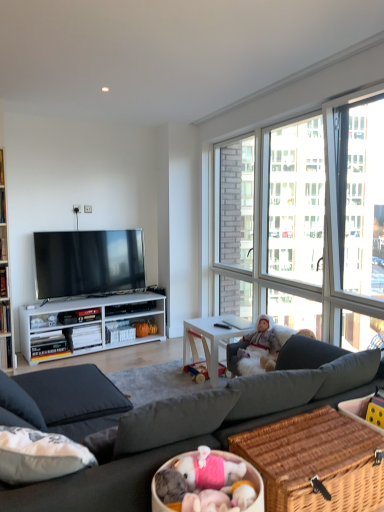
Question: Could woven brown picnic basket at lower right be considered to be inside dark gray fabric couch at center?

Choices:
 (A) yes
 (B) no

Answer: (B)

Question: From the image's perspective, is dark gray fabric couch at center below woven brown picnic basket at lower right?

Choices:
 (A) no
 (B) yes

Answer: (B)

Question: Is dark gray fabric couch at center located outside woven brown picnic basket at lower right?

Choices:
 (A) yes
 (B) no

Answer: (A)

Question: Is dark gray fabric couch at center touching woven brown picnic basket at lower right?

Choices:
 (A) no
 (B) yes

Answer: (A)

Question: Is dark gray fabric couch at center at the right side of woven brown picnic basket at lower right?

Choices:
 (A) yes
 (B) no

Answer: (B)

Question: From a real-world perspective, is dark gray fabric couch at center over woven brown picnic basket at lower right?

Choices:
 (A) yes
 (B) no

Answer: (B)

Question: Does matte black tv at center have a larger size compared to woven brown picnic basket at lower right?

Choices:
 (A) no
 (B) yes

Answer: (B)

Question: From a real-world perspective, is matte black tv at center over woven brown picnic basket at lower right?

Choices:
 (A) no
 (B) yes

Answer: (B)

Question: From a real-world perspective, is matte black tv at center beneath woven brown picnic basket at lower right?

Choices:
 (A) yes
 (B) no

Answer: (B)

Question: Does matte black tv at center have a lesser width compared to woven brown picnic basket at lower right?

Choices:
 (A) yes
 (B) no

Answer: (A)

Question: Can you see matte black tv at center touching woven brown picnic basket at lower right?

Choices:
 (A) yes
 (B) no

Answer: (B)

Question: Can you confirm if matte black tv at center is wider than woven brown picnic basket at lower right?

Choices:
 (A) yes
 (B) no

Answer: (B)

Question: Considering the relative positions of matte black tv at center and white wood desk at center in the image provided, is matte black tv at center behind white wood desk at center?

Choices:
 (A) yes
 (B) no

Answer: (A)